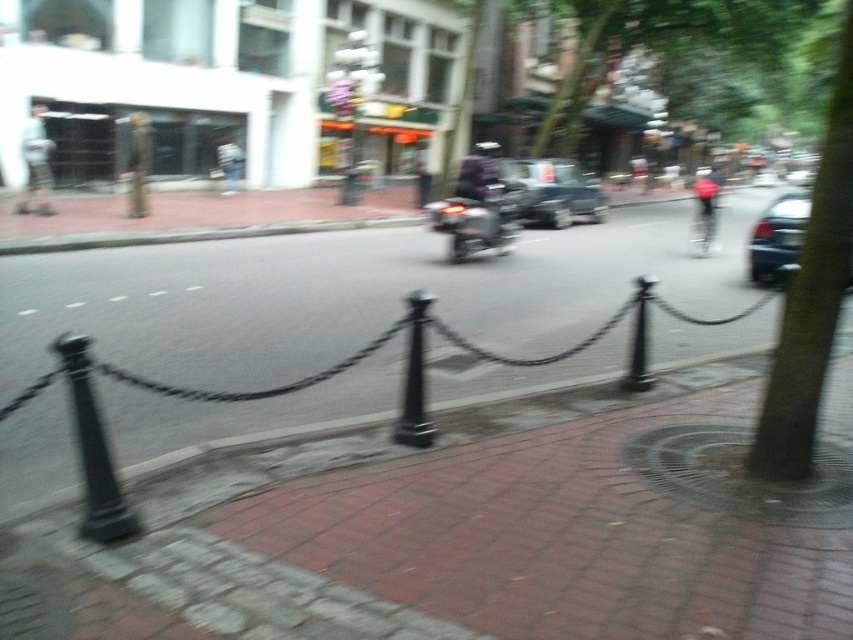
Does point (74, 404) come behind point (486, 240)?

That is False.

Who is positioned more to the right, black metal pole at lower left or shiny metallic motorcycle at center?

shiny metallic motorcycle at center is more to the right.

Who is more distant from viewer, (90, 531) or (457, 193)?

The point (457, 193) is more distant.

This screenshot has height=640, width=853. I want to click on black metal pole at lower left, so click(93, 449).

Is brick pavement at center above metallic silver car at center?

No.

Is brick pavement at center taller than metallic silver car at center?

In fact, brick pavement at center may be shorter than metallic silver car at center.

This screenshot has width=853, height=640. What do you see at coordinates (357, 292) in the screenshot? I see `brick pavement at center` at bounding box center [357, 292].

At what (x,y) coordinates should I click in order to perform the action: click on brick pavement at center. Please return your answer as a coordinate pair (x, y). Image resolution: width=853 pixels, height=640 pixels. Looking at the image, I should click on (357, 292).

Is green leafy tree at right taller than metallic silver car at center?

Correct, green leafy tree at right is much taller as metallic silver car at center.

Who is lower down, green leafy tree at right or metallic silver car at center?

Positioned lower is green leafy tree at right.

Is point (848, 93) closer to camera compared to point (521, 164)?

Yes, it is.

The image size is (853, 640). In order to click on green leafy tree at right in this screenshot , I will do `click(811, 298)`.